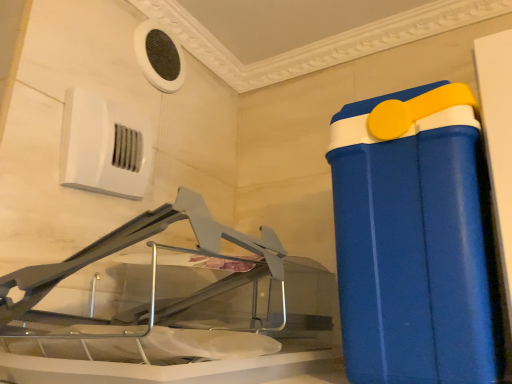
Question: From a real-world perspective, is white plastic air conditioning unit at upper left, the second air conditioning in the top-to-bottom sequence, physically above blue plastic container at right?

Choices:
 (A) no
 (B) yes

Answer: (B)

Question: Considering the relative sizes of white plastic air conditioning unit at upper left, which appears as the 1th air conditioning when viewed from the front, and blue plastic container at right in the image provided, is white plastic air conditioning unit at upper left, which appears as the 1th air conditioning when viewed from the front, thinner than blue plastic container at right?

Choices:
 (A) yes
 (B) no

Answer: (A)

Question: Is white plastic air conditioning unit at upper left, which appears as the 1th air conditioning when viewed from the front, closer to the viewer compared to blue plastic container at right?

Choices:
 (A) no
 (B) yes

Answer: (A)

Question: Can you confirm if white plastic air conditioning unit at upper left, the second air conditioning in the top-to-bottom sequence, is taller than blue plastic container at right?

Choices:
 (A) no
 (B) yes

Answer: (A)

Question: Can you confirm if white plastic air conditioning unit at upper left, the second air conditioning in the top-to-bottom sequence, is smaller than blue plastic container at right?

Choices:
 (A) no
 (B) yes

Answer: (B)

Question: Is white plastic air conditioning unit at upper left, which appears as the 1th air conditioning when viewed from the front, completely or partially outside of blue plastic container at right?

Choices:
 (A) yes
 (B) no

Answer: (A)

Question: From the image's perspective, is blue plastic container at right beneath white mesh air conditioning at upper left, the 2th air conditioning when ordered from front to back?

Choices:
 (A) yes
 (B) no

Answer: (A)

Question: From a real-world perspective, is blue plastic container at right on top of white mesh air conditioning at upper left, the 2th air conditioning when ordered from front to back?

Choices:
 (A) yes
 (B) no

Answer: (B)

Question: Can you confirm if blue plastic container at right is wider than white mesh air conditioning at upper left, placed as the first air conditioning when sorted from back to front?

Choices:
 (A) no
 (B) yes

Answer: (B)

Question: Is blue plastic container at right in front of white mesh air conditioning at upper left, which is the 1th air conditioning in top-to-bottom order?

Choices:
 (A) yes
 (B) no

Answer: (A)

Question: Is blue plastic container at right oriented away from white mesh air conditioning at upper left, which is the 1th air conditioning in top-to-bottom order?

Choices:
 (A) no
 (B) yes

Answer: (A)

Question: Can you confirm if blue plastic container at right is positioned to the right of white mesh air conditioning at upper left, placed as the first air conditioning when sorted from back to front?

Choices:
 (A) yes
 (B) no

Answer: (A)

Question: Is white plastic air conditioning unit at upper left, arranged as the second air conditioning when viewed from the back, behind white mesh air conditioning at upper left, placed as the first air conditioning when sorted from back to front?

Choices:
 (A) yes
 (B) no

Answer: (B)